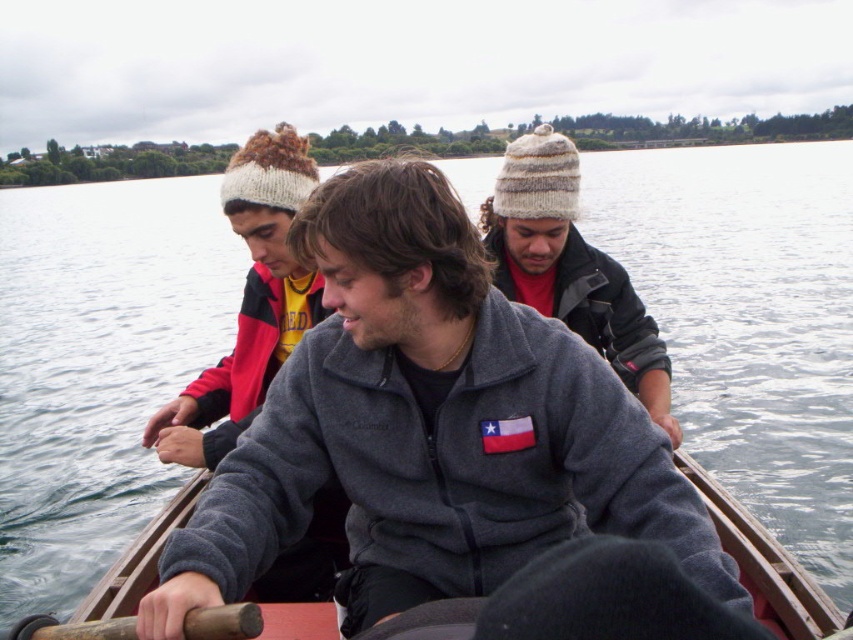
You are a photographer trying to capture a clear shot of the knitted wool beanie at upper center and the wooden canoe at center. Based on their sizes in the image, which object appears larger?

The knitted wool beanie at upper center is taller than the wooden canoe at center, so it appears larger in the image.

You are a photographer trying to capture a clear shot of both knitted wool beanie at upper left and knitted wool beanie at upper center. Which beanie should you focus on first if you want to ensure both are in frame without moving the camera?

You should focus on the knitted wool beanie at upper left first because it is taller than the knitted wool beanie at upper center, so it will occupy more space in the frame and help ensure both are visible without needing to adjust the camera position.

You are a photographer taking a picture of the group in the boat. You notice a point at coordinates (570, 266). What object is this point located on?

The point at coordinates (570, 266) is located on the knitted wool beanie at upper center.